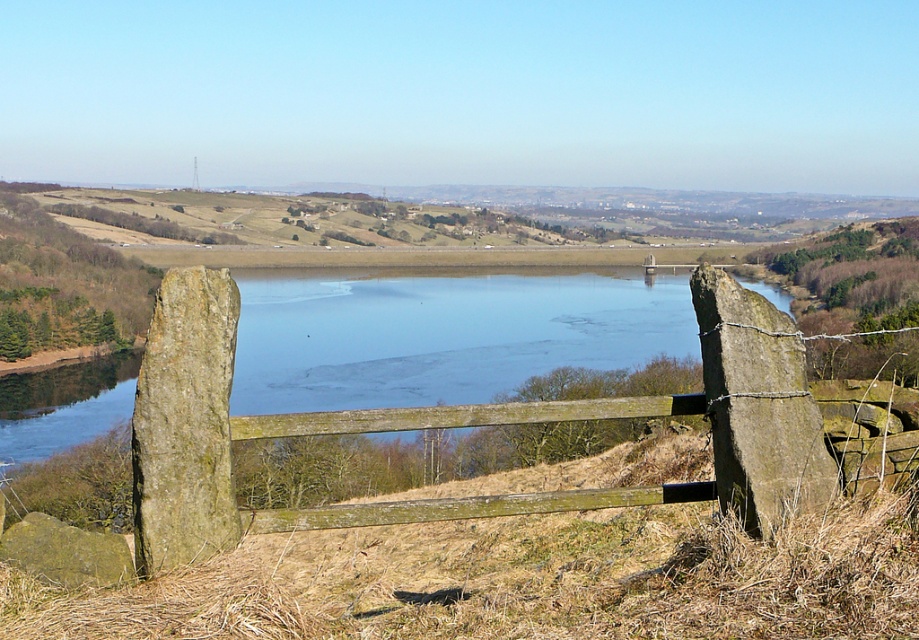
You are a landscape architect designing a pathway near the rustic wooden gate. You need to place stepping stones between the rough textured stone at center and the rough textured stone at lower left. Which stone should the stepping stones be placed closer to if you want to ensure they are spaced evenly along the path?

The stepping stones should be placed closer to the rough textured stone at lower left because the rough textured stone at center might be wider, requiring more space between them for even spacing.

You are a painter setting up your easel to capture the landscape. You want to ensure your painting accurately represents the relative sizes of the wooden gate at center and the green rough stone at left. Which object should you depict as larger in your artwork?

The wooden gate at center should be depicted as larger in your artwork since it is taller than the green rough stone at left.